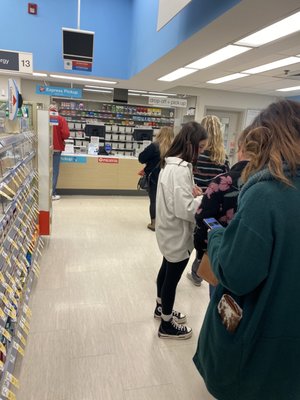
Where is `wall above door`? The height and width of the screenshot is (400, 300). wall above door is located at coordinates (223, 99).